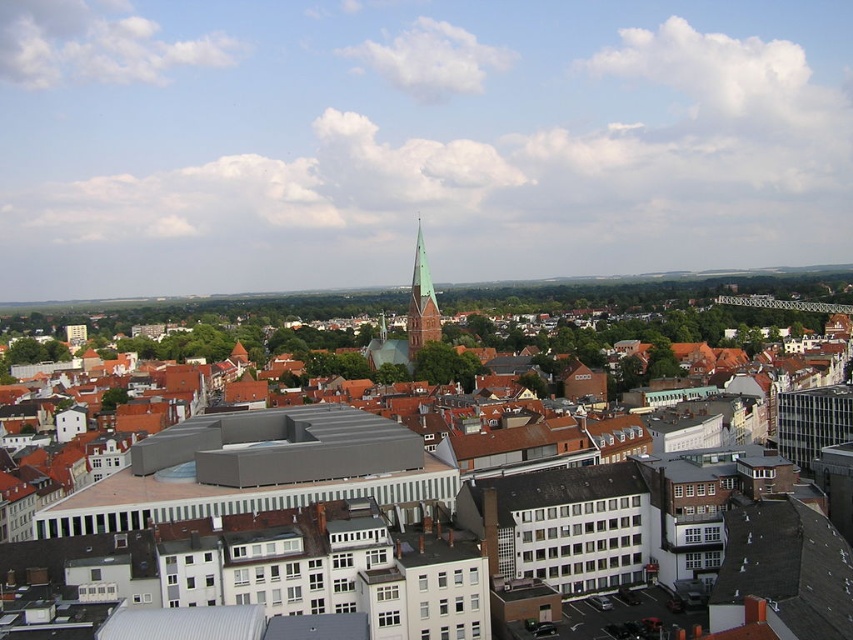
You are standing in the city square and see the white matte building at center and the green glazed brick tower at center. Which one is located to the left of the other?

The white matte building at center is positioned on the right side of green glazed brick tower at center, so the green glazed brick tower at center is to the left of the white matte building at center.

Consider the image. What are the coordinates of the white matte building at center in the cityscape image?

The white matte building at center is located at coordinates point (x=260, y=472).

You are an architect analyzing the cityscape. You notice the white matte building at center and the green glazed brick tower at center. Based on their positions, which one is closer to the ground?

The white matte building at center is located below the green glazed brick tower at center, so it is closer to the ground.